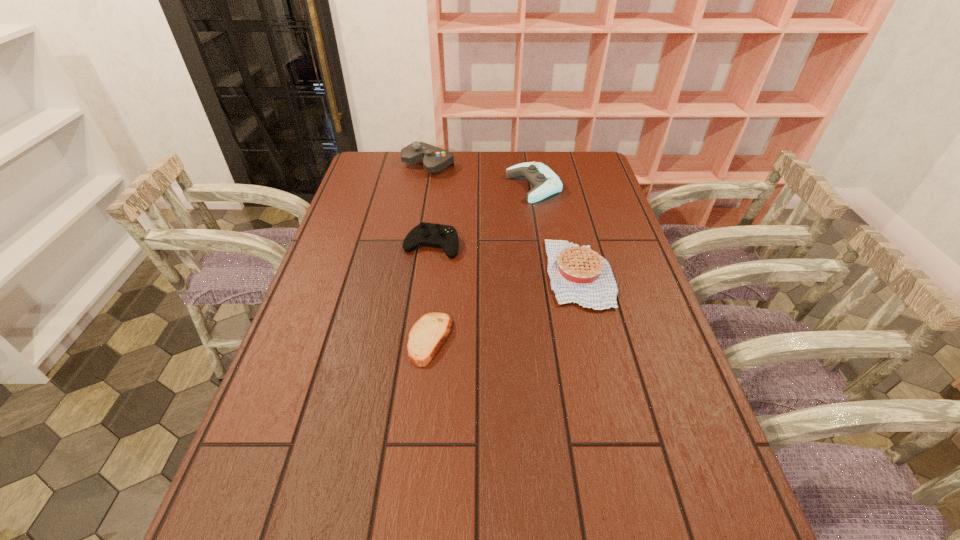
Locate an element on the screen. control that is the second nearest to the nearest control is located at coordinates (434, 159).

Find the location of `control that stands as the third closest to the pie`. control that stands as the third closest to the pie is located at coordinates (434, 159).

Locate an element on the screen. The height and width of the screenshot is (540, 960). free location that satisfies the following two spatial constraints: 1. on the front side of the pie; 2. on the right side of the rightmost control is located at coordinates (549, 274).

The width and height of the screenshot is (960, 540). I want to click on free space that satisfies the following two spatial constraints: 1. on the front side of the pita bread; 2. on the left side of the nearest control, so click(x=420, y=339).

You are a GUI agent. You are given a task and a screenshot of the screen. Output one action in this format:
    pyautogui.click(x=<x>, y=<y>)
    Task: Click on the free space that satisfies the following two spatial constraints: 1. on the back side of the rightmost control; 2. on the left side of the pita bread
    The image size is (960, 540).
    Given the screenshot: What is the action you would take?
    pyautogui.click(x=446, y=187)